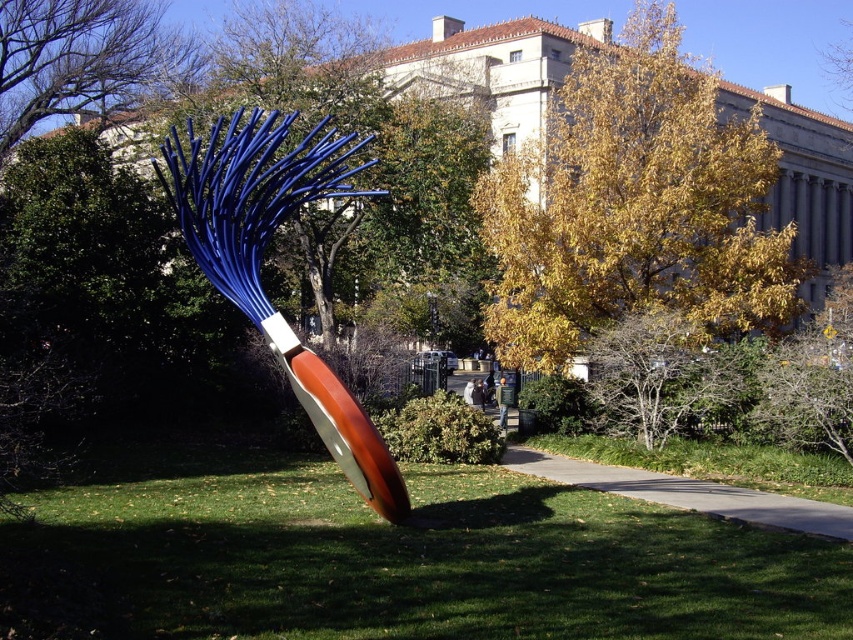
Question: Does golden leafy tree at upper center have a lesser width compared to bare branches at upper left?

Choices:
 (A) yes
 (B) no

Answer: (B)

Question: Is green grass at center positioned behind green grass at lower center?

Choices:
 (A) yes
 (B) no

Answer: (B)

Question: Which point is closer to the camera?

Choices:
 (A) green grass at lower center
 (B) bare branches at upper left
 (C) golden leafy tree at upper center

Answer: (A)

Question: Is green grass at center to the right of golden leafy tree at upper center from the viewer's perspective?

Choices:
 (A) yes
 (B) no

Answer: (B)

Question: Which point appears closest to the camera in this image?

Choices:
 (A) (699, 451)
 (B) (334, 589)
 (C) (791, 291)

Answer: (B)

Question: Which point appears farthest from the camera in this image?

Choices:
 (A) (84, 104)
 (B) (669, 38)
 (C) (221, 253)

Answer: (A)